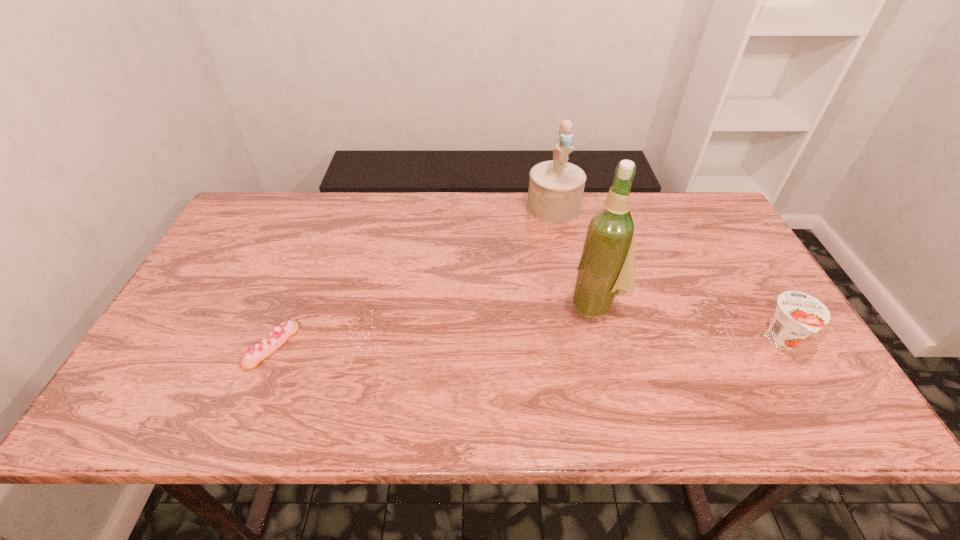
Image resolution: width=960 pixels, height=540 pixels. Find the location of `vacant space on the desktop that is between the shortest object and the rightmost object and is positioned on the front-facing side of the tallest object`. vacant space on the desktop that is between the shortest object and the rightmost object and is positioned on the front-facing side of the tallest object is located at coordinates (528, 344).

Locate an element on the screen. The height and width of the screenshot is (540, 960). free spot on the desktop that is between the shortest object and the third tallest object and is positioned at the beak of the farthest object is located at coordinates (591, 343).